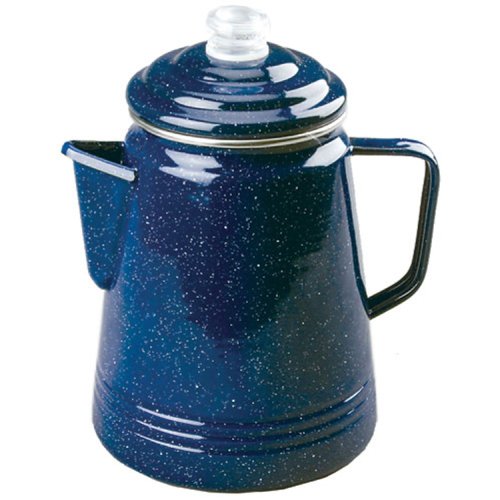
Find the location of a particular element. blue teapot is located at coordinates (228, 277).